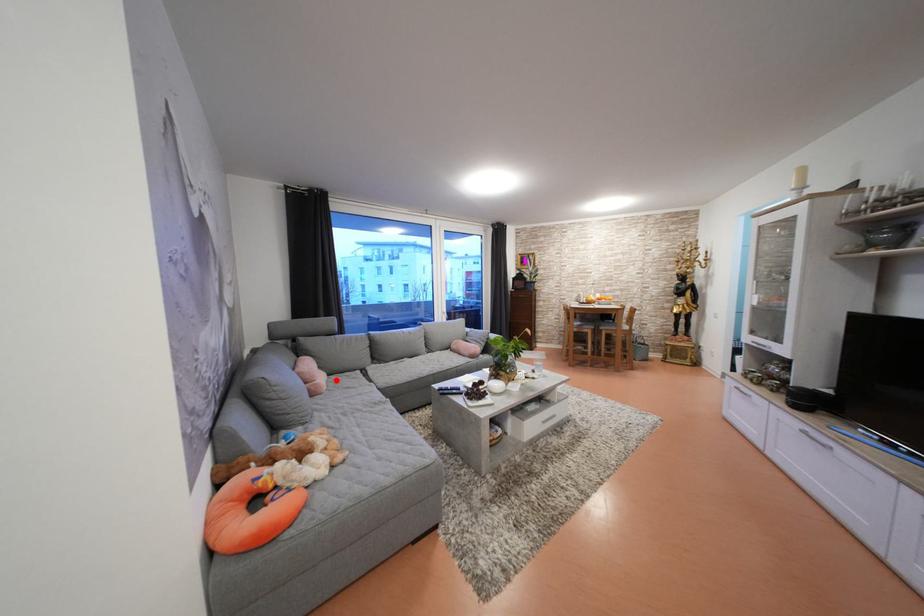
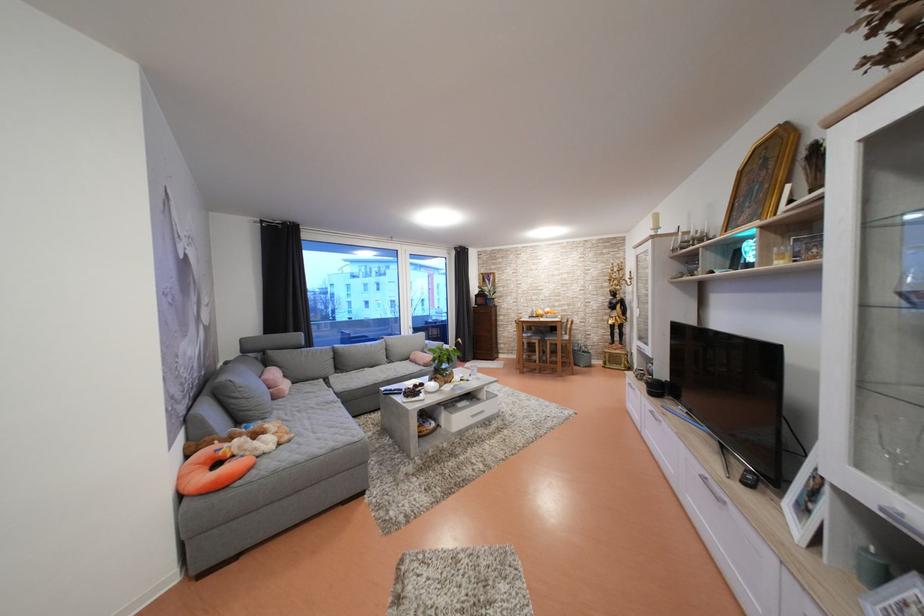
Where in the second image is the point corresponding to the highlighted location from the first image?

(300, 387)